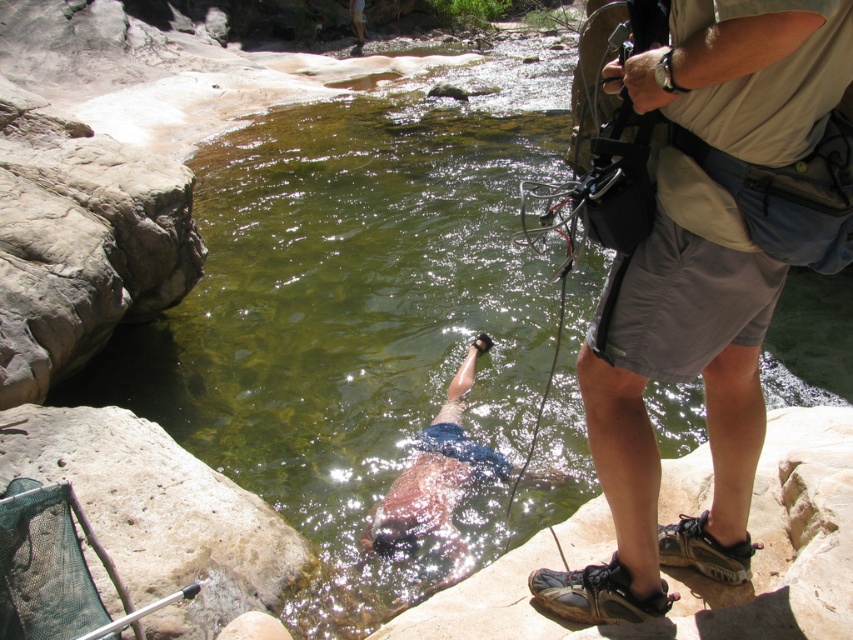
This screenshot has width=853, height=640. What are the coordinates of `tan fabric shirt at upper right` in the screenshot? It's located at (672, 380).

Does point (619, 593) come in front of point (614, 628)?

No, (619, 593) is behind (614, 628).

At what (x,y) coordinates should I click in order to perform the action: click on tan fabric shirt at upper right. Please return your answer as a coordinate pair (x, y). The height and width of the screenshot is (640, 853). Looking at the image, I should click on (672, 380).

Measure the distance between brown rock at lower center and smooth beige rock at lower left.

They are 1.32 meters apart.

Between brown rock at lower center and smooth beige rock at lower left, which one has less height?

Standing shorter between the two is brown rock at lower center.

The height and width of the screenshot is (640, 853). I want to click on brown rock at lower center, so click(x=689, y=570).

In the scene shown: Can you confirm if tan fabric shirt at upper right is wider than smooth beige rock at lower left?

Incorrect, tan fabric shirt at upper right's width does not surpass smooth beige rock at lower left's.

Based on the photo, is the position of tan fabric shirt at upper right more distant than that of smooth beige rock at lower left?

No, tan fabric shirt at upper right is closer to the viewer.

Is point (747, 72) closer to camera compared to point (86, 496)?

Yes, it is.

Where is `tan fabric shirt at upper right`? tan fabric shirt at upper right is located at coordinates (672, 380).